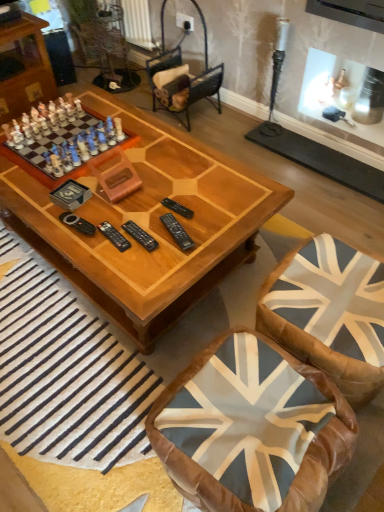
Where is `vacant area that is in front of black plastic remote at center`? This screenshot has width=384, height=512. vacant area that is in front of black plastic remote at center is located at coordinates (140, 270).